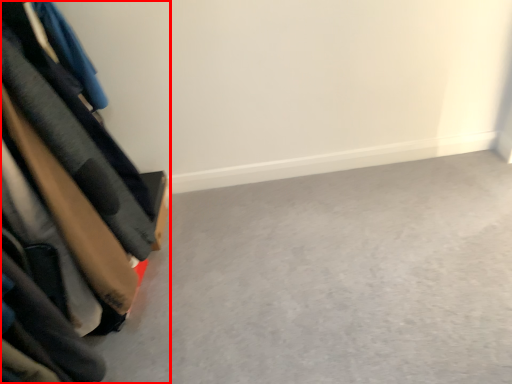
Question: From the image's perspective, where is furniture (annotated by the red box) located in relation to concrete in the image?

Choices:
 (A) above
 (B) below

Answer: (A)